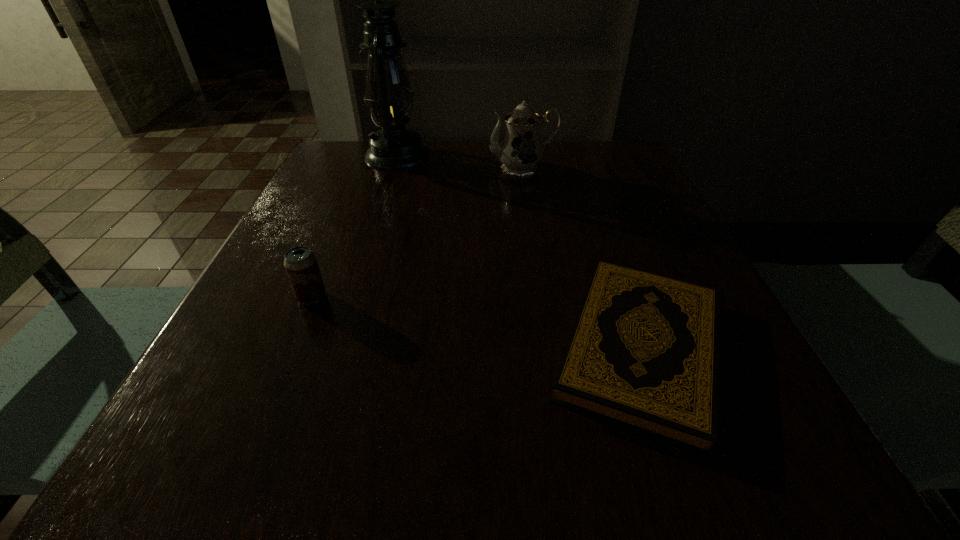
At what (x,y) coordinates should I click in order to perform the action: click on object at the near edge. Please return your answer as a coordinate pair (x, y). Looking at the image, I should click on (643, 353).

At what (x,y) coordinates should I click in order to perform the action: click on oil lamp positioned at the left edge. Please return your answer as a coordinate pair (x, y). This screenshot has height=540, width=960. Looking at the image, I should click on coord(389,95).

Locate an element on the screen. This screenshot has width=960, height=540. beer can that is at the left edge is located at coordinates pos(300,263).

In order to click on object that is at the right edge in this screenshot , I will do `click(643, 353)`.

Find the location of a particular element. object positioned at the far left corner is located at coordinates (389, 95).

Locate an element on the screen. object situated at the near right corner is located at coordinates (643, 353).

Image resolution: width=960 pixels, height=540 pixels. In the image, there is a desktop. Identify the location of free space at the far edge. (512, 183).

I want to click on free space at the near edge of the desktop, so click(475, 472).

This screenshot has width=960, height=540. In order to click on blank space at the left edge of the desktop in this screenshot , I will do `click(333, 301)`.

Where is `free location at the right edge`? free location at the right edge is located at coordinates (690, 261).